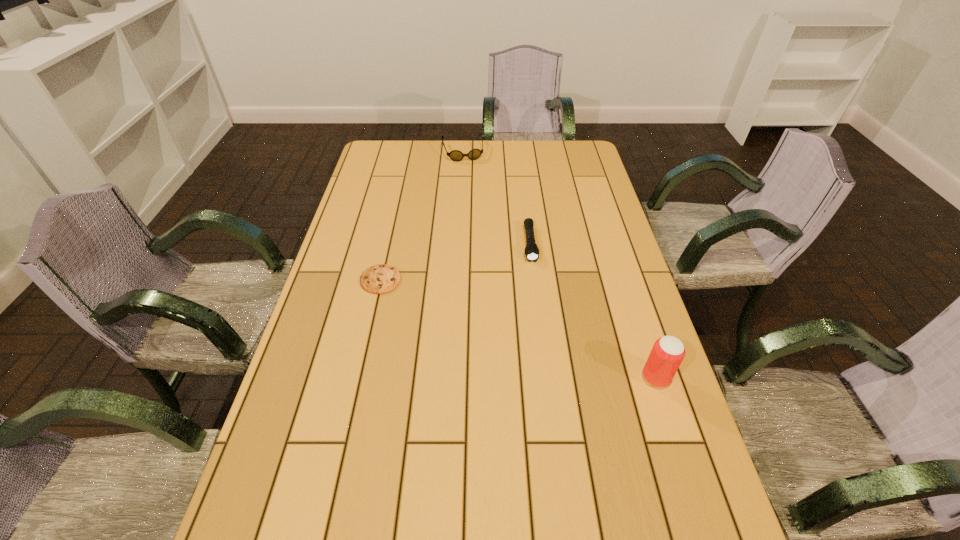
You are a GUI agent. You are given a task and a screenshot of the screen. Output one action in this format:
    pyautogui.click(x=<x>, y=<y>)
    Task: Click on the free spot between the second object from left to right and the rightmost object
    
    Given the screenshot: What is the action you would take?
    pyautogui.click(x=560, y=264)

I want to click on vacant space that's between the rightmost object and the third object from left to right, so click(593, 310).

At what (x,y) coordinates should I click in order to perform the action: click on blank region between the tallest object and the shortest object. Please return your answer as a coordinate pair (x, y). Looking at the image, I should click on (518, 329).

The width and height of the screenshot is (960, 540). Identify the location of empty location between the third object from left to right and the leftmost object. click(x=455, y=262).

You are a GUI agent. You are given a task and a screenshot of the screen. Output one action in this format:
    pyautogui.click(x=<x>, y=<y>)
    Task: Click on the unoccupied position between the third farthest object and the second object from left to right
    Image resolution: width=960 pixels, height=540 pixels.
    Given the screenshot: What is the action you would take?
    pyautogui.click(x=421, y=215)

Locate which object ranks third in proximity to the beer can. Please provide its 2D coordinates. Your answer should be formatted as a tuple, i.e. [(x, y)], where the tuple contains the x and y coordinates of a point satisfying the conditions above.

[(455, 155)]

Where is `object that is the closest one to the rightmost object`? This screenshot has width=960, height=540. object that is the closest one to the rightmost object is located at coordinates (531, 250).

Find the location of a particular element. The width and height of the screenshot is (960, 540). free spot that satisfies the following two spatial constraints: 1. on the front side of the shortest object; 2. on the left side of the rightmost object is located at coordinates (359, 377).

At what (x,y) coordinates should I click in order to perform the action: click on vacant space that satisfies the following two spatial constraints: 1. on the front side of the leftmost object; 2. on the left side of the rightmost object. Please return your answer as a coordinate pair (x, y). Looking at the image, I should click on (359, 377).